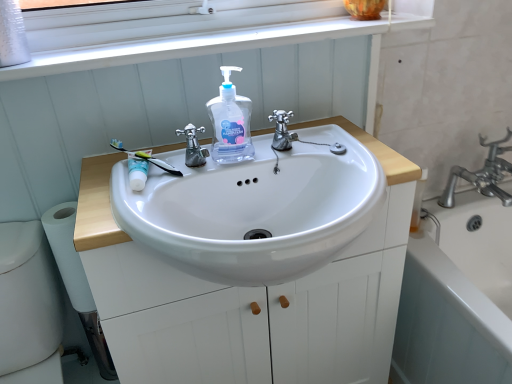
At what (x,y) coordinates should I click in order to perform the action: click on vacant space situated on the left part of polished chrome faucet at center, the second tap positioned from the right. Please return your answer as a coordinate pair (x, y). The height and width of the screenshot is (384, 512). Looking at the image, I should click on (114, 183).